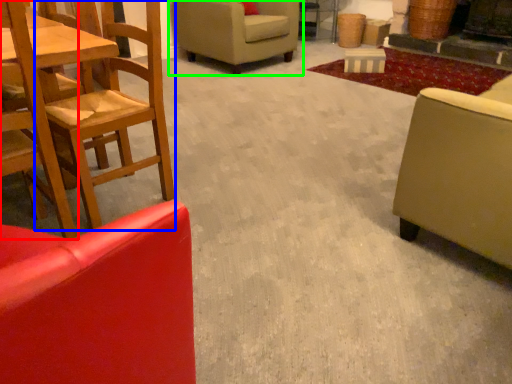
Question: Which is farther away from chair (highlighted by a red box)? chair (highlighted by a blue box) or chair (highlighted by a green box)?

Choices:
 (A) chair
 (B) chair

Answer: (B)